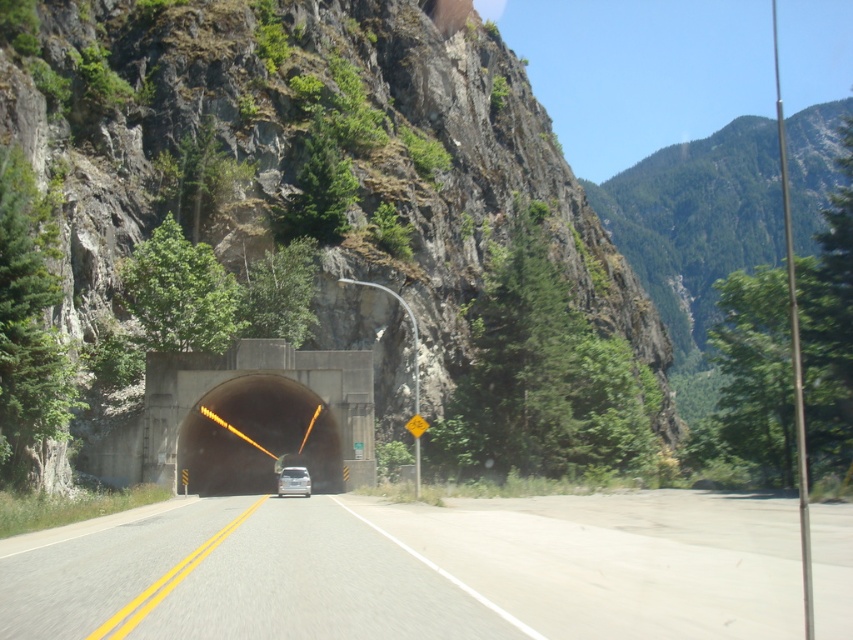
Looking at this image, which of these two, rocky gray mountain at center or black concrete tunnel at center, stands shorter?

With less height is black concrete tunnel at center.

Where is `rocky gray mountain at center`? Image resolution: width=853 pixels, height=640 pixels. rocky gray mountain at center is located at coordinates (300, 161).

Image resolution: width=853 pixels, height=640 pixels. In order to click on rocky gray mountain at center in this screenshot , I will do `click(300, 161)`.

The width and height of the screenshot is (853, 640). In order to click on rocky gray mountain at center in this screenshot , I will do `click(300, 161)`.

Is point (294, 579) farther from camera compared to point (252, 404)?

That is False.

Consider the image. Does asphalt road at center have a greater width compared to black concrete tunnel at center?

Indeed, asphalt road at center has a greater width compared to black concrete tunnel at center.

Who is more forward, (131, 563) or (206, 467)?

Positioned in front is point (131, 563).

The width and height of the screenshot is (853, 640). What are the coordinates of `asphalt road at center` in the screenshot? It's located at (415, 570).

Is rocky gray mountain at center below silver metallic car at center?

Incorrect, rocky gray mountain at center is not positioned below silver metallic car at center.

Consider the image. Does rocky gray mountain at center have a smaller size compared to silver metallic car at center?

No.

The image size is (853, 640). Describe the element at coordinates (300, 161) in the screenshot. I see `rocky gray mountain at center` at that location.

Find the location of a particular element. This screenshot has height=640, width=853. rocky gray mountain at center is located at coordinates (300, 161).